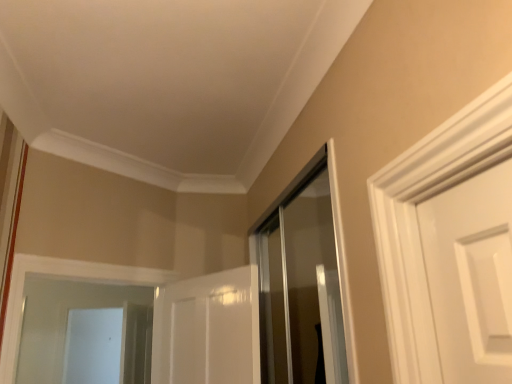
Question: From their relative heights in the image, would you say white glossy screen door at lower left is taller or shorter than clear glass shower door at center?

Choices:
 (A) tall
 (B) short

Answer: (A)

Question: Visually, is white glossy screen door at lower left positioned to the left or to the right of clear glass shower door at center?

Choices:
 (A) right
 (B) left

Answer: (B)

Question: Choose the correct answer: Is white glossy screen door at lower left inside clear glass shower door at center or outside it?

Choices:
 (A) outside
 (B) inside

Answer: (A)

Question: From a real-world perspective, is clear glass shower door at center positioned above or below white glossy screen door at lower left?

Choices:
 (A) below
 (B) above

Answer: (B)

Question: Looking at the image, does clear glass shower door at center seem bigger or smaller compared to white glossy screen door at lower left?

Choices:
 (A) big
 (B) small

Answer: (B)

Question: Is clear glass shower door at center spatially inside white glossy screen door at lower left, or outside of it?

Choices:
 (A) inside
 (B) outside

Answer: (B)

Question: In terms of height, does clear glass shower door at center look taller or shorter compared to white glossy screen door at lower left?

Choices:
 (A) short
 (B) tall

Answer: (A)